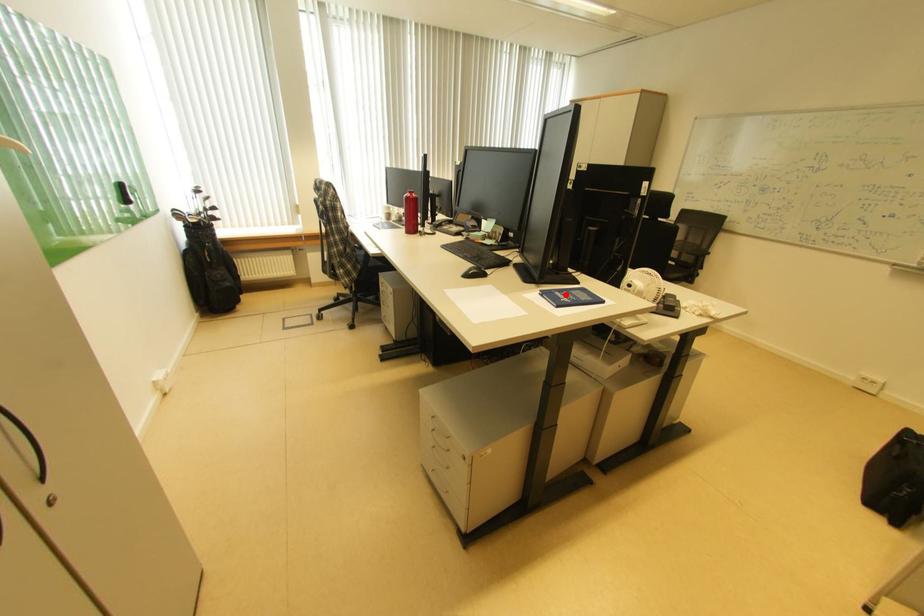
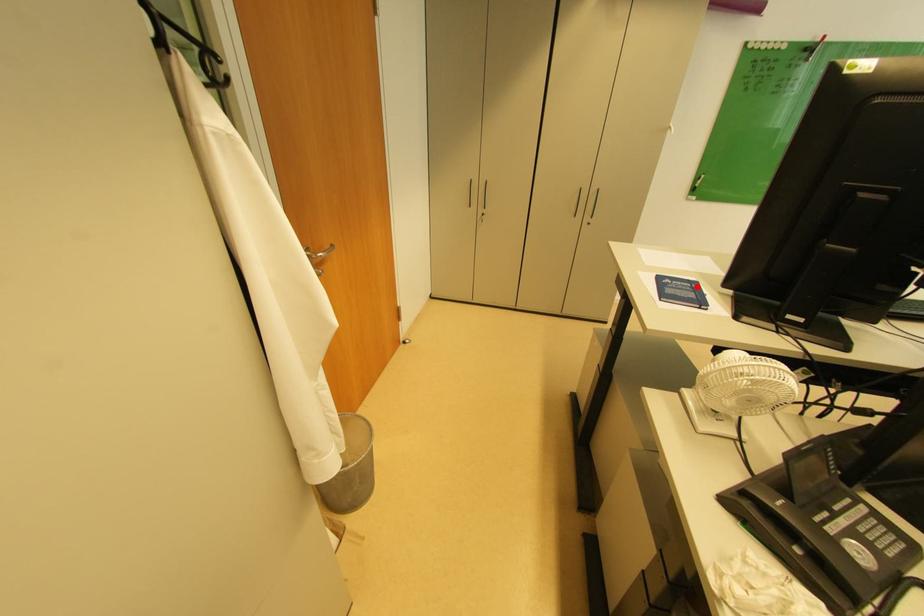
I am providing you with two images of the same scene from different viewpoints. A red point is marked on the first image and another point is marked on the second image. Do the highlighted points in image1 and image2 indicate the same real-world spot?

Yes